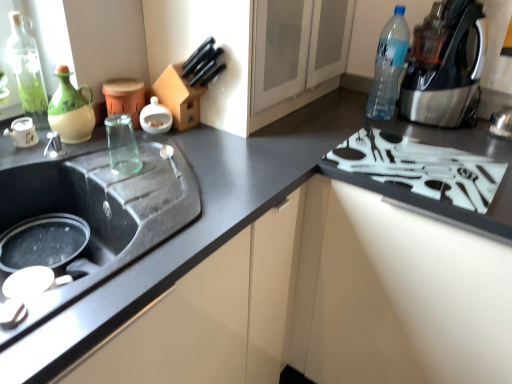
Image resolution: width=512 pixels, height=384 pixels. I want to click on black matte sink at left, so click(x=100, y=213).

This screenshot has width=512, height=384. What are the coordinates of `matte glass jar at upper left, arranged as the 2th appliance when viewed from the left` in the screenshot? It's located at (124, 97).

Image resolution: width=512 pixels, height=384 pixels. In order to click on stainless steel kettle at upper right, arranged as the 3th appliance when viewed from the left in this screenshot , I will do `click(501, 123)`.

Locate an element on the screen. The width and height of the screenshot is (512, 384). black matte sink at left is located at coordinates (100, 213).

From a real-world perspective, which object rests below the other?

black matte sink at left is physically lower.

Does point (400, 58) lie in front of point (101, 250)?

No, it is behind (101, 250).

I want to click on sink on the left of the blue plastic bottle at upper right, the 1th bottle in the right-to-left sequence, so click(x=100, y=213).

Is blue plastic bottle at upper right, the 1th bottle in the right-to-left sequence, to the right of black matte sink at left from the viewer's perspective?

Yes.

How distant is matte glass jar at upper left, arranged as the 2th appliance when viewed from the left, from green glass bottle at upper left, the 1th bottle positioned from the left?

matte glass jar at upper left, arranged as the 2th appliance when viewed from the left, and green glass bottle at upper left, the 1th bottle positioned from the left, are 9.07 inches apart from each other.

Is green glass bottle at upper left, the second bottle from the right, at the back of matte glass jar at upper left, arranged as the 2th appliance when viewed from the left?

No, matte glass jar at upper left, arranged as the 2th appliance when viewed from the left, is not facing the opposite direction of green glass bottle at upper left, the second bottle from the right.

Considering the sizes of objects matte glass jar at upper left, acting as the 2th appliance starting from the right, and green glass bottle at upper left, the second bottle from the right, in the image provided, who is smaller, matte glass jar at upper left, acting as the 2th appliance starting from the right, or green glass bottle at upper left, the second bottle from the right,?

matte glass jar at upper left, acting as the 2th appliance starting from the right.

Which object is closer to the camera taking this photo, matte glass jar at upper left, acting as the 2th appliance starting from the right, or green glass bottle at upper left, the second bottle from the right?

green glass bottle at upper left, the second bottle from the right, is closer to the camera.

Which is further, [500,111] or [112,99]?

The point [500,111] is farther from the camera.

Considering their positions, is stainless steel kettle at upper right, the first appliance when ordered from right to left, located in front of or behind matte glass jar at upper left, acting as the 2th appliance starting from the right?

stainless steel kettle at upper right, the first appliance when ordered from right to left, is positioned farther from the viewer than matte glass jar at upper left, acting as the 2th appliance starting from the right.

Is stainless steel kettle at upper right, arranged as the 3th appliance when viewed from the left, not inside matte glass jar at upper left, arranged as the 2th appliance when viewed from the left?

Yes, stainless steel kettle at upper right, arranged as the 3th appliance when viewed from the left, is outside of matte glass jar at upper left, arranged as the 2th appliance when viewed from the left.

Is point (124, 133) behind point (57, 103)?

Yes, it is behind point (57, 103).

Is transparent glass cup at sink in contact with green matte teapot at left?

There is a gap between transparent glass cup at sink and green matte teapot at left.

Between transparent glass cup at sink and green matte teapot at left, which one appears on the left side from the viewer's perspective?

From the viewer's perspective, green matte teapot at left appears more on the left side.

Is transparent glass cup at sink inside the boundaries of green matte teapot at left, or outside?

transparent glass cup at sink is located beyond the bounds of green matte teapot at left.

Between point (392, 71) and point (507, 125), which one is positioned behind?

The point (392, 71) is farther from the camera.

From a real-world perspective, is blue plastic bottle at upper right, the 1th bottle in the right-to-left sequence, positioned over stainless steel kettle at upper right, the first appliance when ordered from right to left, based on gravity?

Indeed, from a real-world perspective, blue plastic bottle at upper right, the 1th bottle in the right-to-left sequence, stands above stainless steel kettle at upper right, the first appliance when ordered from right to left.

Measure the distance from blue plastic bottle at upper right, placed as the 2th bottle when sorted from left to right, to stainless steel kettle at upper right, arranged as the 3th appliance when viewed from the left.

They are 14.04 inches apart.

Considering the sizes of objects blue plastic bottle at upper right, the 1th bottle in the right-to-left sequence, and stainless steel kettle at upper right, arranged as the 3th appliance when viewed from the left, in the image provided, who is shorter, blue plastic bottle at upper right, the 1th bottle in the right-to-left sequence, or stainless steel kettle at upper right, arranged as the 3th appliance when viewed from the left,?

stainless steel kettle at upper right, arranged as the 3th appliance when viewed from the left, is shorter.

From the image's perspective, is green glass bottle at upper left, the 1th bottle positioned from the left, beneath blue plastic bottle at upper right, the 1th bottle in the right-to-left sequence?

Indeed, from the image's perspective, green glass bottle at upper left, the 1th bottle positioned from the left, is shown beneath blue plastic bottle at upper right, the 1th bottle in the right-to-left sequence.

Is green glass bottle at upper left, the second bottle from the right, next to blue plastic bottle at upper right, the 1th bottle in the right-to-left sequence, and touching it?

There is a gap between green glass bottle at upper left, the second bottle from the right, and blue plastic bottle at upper right, the 1th bottle in the right-to-left sequence.

How different are the orientations of green glass bottle at upper left, the second bottle from the right, and blue plastic bottle at upper right, the 1th bottle in the right-to-left sequence, in degrees?

The facing directions of green glass bottle at upper left, the second bottle from the right, and blue plastic bottle at upper right, the 1th bottle in the right-to-left sequence, are 88.7 degrees apart.

Between green glass bottle at upper left, the 1th bottle positioned from the left, and blue plastic bottle at upper right, placed as the 2th bottle when sorted from left to right, which one appears on the right side from the viewer's perspective?

Positioned to the right is blue plastic bottle at upper right, placed as the 2th bottle when sorted from left to right.

Choose the correct answer: Is black plastic coffee machine at upper right inside stainless steel kettle at upper right, arranged as the 3th appliance when viewed from the left, or outside it?

black plastic coffee machine at upper right is spatially situated outside stainless steel kettle at upper right, arranged as the 3th appliance when viewed from the left.

Is black plastic coffee machine at upper right closer to camera compared to stainless steel kettle at upper right, the first appliance when ordered from right to left?

Yes, the depth of black plastic coffee machine at upper right is less than that of stainless steel kettle at upper right, the first appliance when ordered from right to left.

From the image's perspective, is black plastic coffee machine at upper right located above or below stainless steel kettle at upper right, the first appliance when ordered from right to left?

black plastic coffee machine at upper right is situated higher than stainless steel kettle at upper right, the first appliance when ordered from right to left, in the image.

Looking at this image, is black plastic coffee machine at upper right wider or thinner than stainless steel kettle at upper right, arranged as the 3th appliance when viewed from the left?

In the image, black plastic coffee machine at upper right appears to be wider than stainless steel kettle at upper right, arranged as the 3th appliance when viewed from the left.

Locate an element on the screen. The image size is (512, 384). the 2nd bottle above the black matte sink at left (from a real-world perspective) is located at coordinates point(388,67).

At what (x,y) coordinates should I click in order to perform the action: click on bottle located in front of the matte glass jar at upper left, arranged as the 2th appliance when viewed from the left. Please return your answer as a coordinate pair (x, y). This screenshot has height=384, width=512. Looking at the image, I should click on (27, 71).

In the scene shown: From the image, which object appears to be nearer to transparent glass cup at sink, black plastic coffee machine at upper right or green matte teapot at left?

green matte teapot at left lies closer to transparent glass cup at sink than the other object.

Estimate the real-world distances between objects in this image. Which object is closer to transparent glass cup at sink, stainless steel kettle at upper right, the first appliance when ordered from right to left, or green matte teapot at left?

Based on the image, green matte teapot at left appears to be nearer to transparent glass cup at sink.

Estimate the real-world distances between objects in this image. Which object is further from white matte teapot at left, marked as the first appliance in a left-to-right arrangement, black plastic coffee machine at upper right or blue plastic bottle at upper right, the 1th bottle in the right-to-left sequence?

Among the two, black plastic coffee machine at upper right is located further to white matte teapot at left, marked as the first appliance in a left-to-right arrangement.

When comparing their distances from white plastic gas stove at right, does white matte teapot at left, marked as the first appliance in a left-to-right arrangement, or green matte teapot at left seem closer?

The object closer to white plastic gas stove at right is green matte teapot at left.

In the scene shown: When comparing their distances from blue plastic bottle at upper right, placed as the 2th bottle when sorted from left to right, does black matte sink at left or stainless steel kettle at upper right, arranged as the 3th appliance when viewed from the left, seem further?

Among the two, black matte sink at left is located further to blue plastic bottle at upper right, placed as the 2th bottle when sorted from left to right.

Looking at the image, which one is located further to green matte teapot at left, transparent glass cup at sink or white matte teapot at left, marked as the first appliance in a left-to-right arrangement?

transparent glass cup at sink is further to green matte teapot at left.

Looking at the image, which one is located closer to green matte teapot at left, transparent glass cup at sink or blue plastic bottle at upper right, the 1th bottle in the right-to-left sequence?

transparent glass cup at sink is positioned closer to the anchor green matte teapot at left.

Looking at this image, based on their spatial positions, is stainless steel kettle at upper right, the first appliance when ordered from right to left, or black matte sink at left further from white plastic gas stove at right?

black matte sink at left is further to white plastic gas stove at right.

This screenshot has width=512, height=384. I want to click on sink between green matte teapot at left and stainless steel kettle at upper right, arranged as the 3th appliance when viewed from the left, from left to right, so click(x=100, y=213).

This screenshot has width=512, height=384. I want to click on appliance between black matte sink at left and stainless steel kettle at upper right, the first appliance when ordered from right to left, in the horizontal direction, so click(124, 97).

The image size is (512, 384). I want to click on beverage located between black matte sink at left and black plastic coffee machine at upper right in the left-right direction, so click(122, 145).

Locate an element on the screen. This screenshot has height=384, width=512. coffee machine between black matte sink at left and stainless steel kettle at upper right, the first appliance when ordered from right to left is located at coordinates (448, 70).